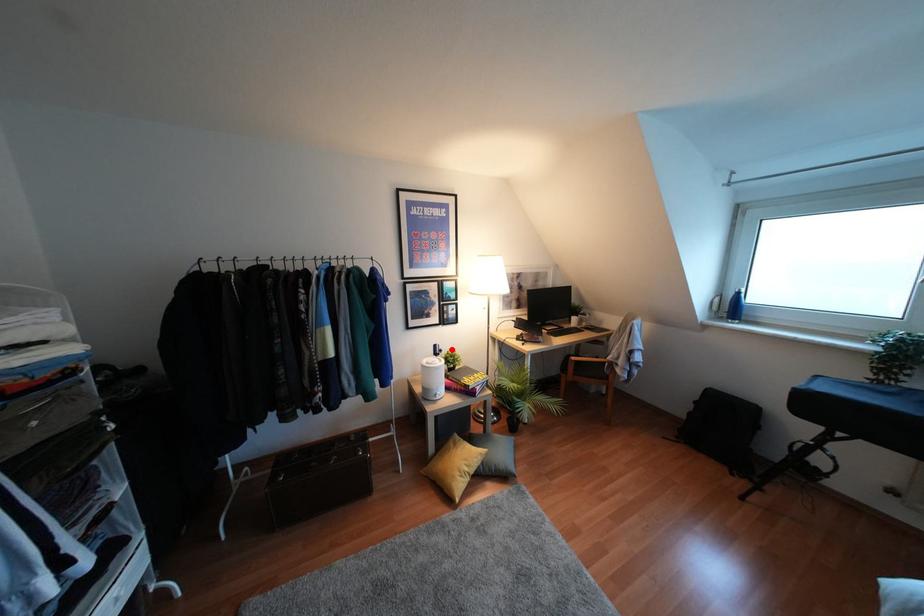
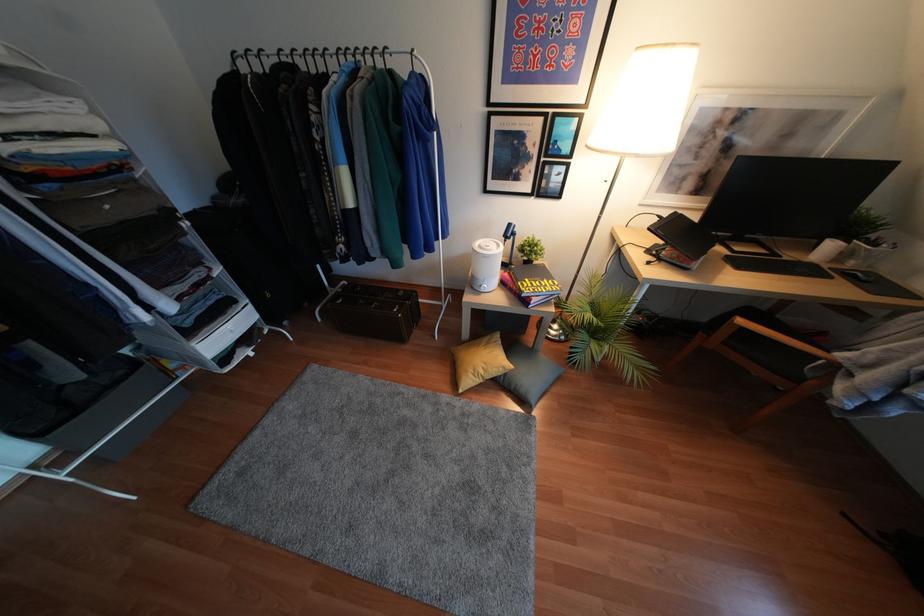
Question: A red point is marked in image1. In image2, is the corresponding 3D point closer to the camera or farther? Reply with the corresponding letter.

Choices:
 (A) The corresponding 3D point is closer.
 (B) The corresponding 3D point is farther.

Answer: (A)